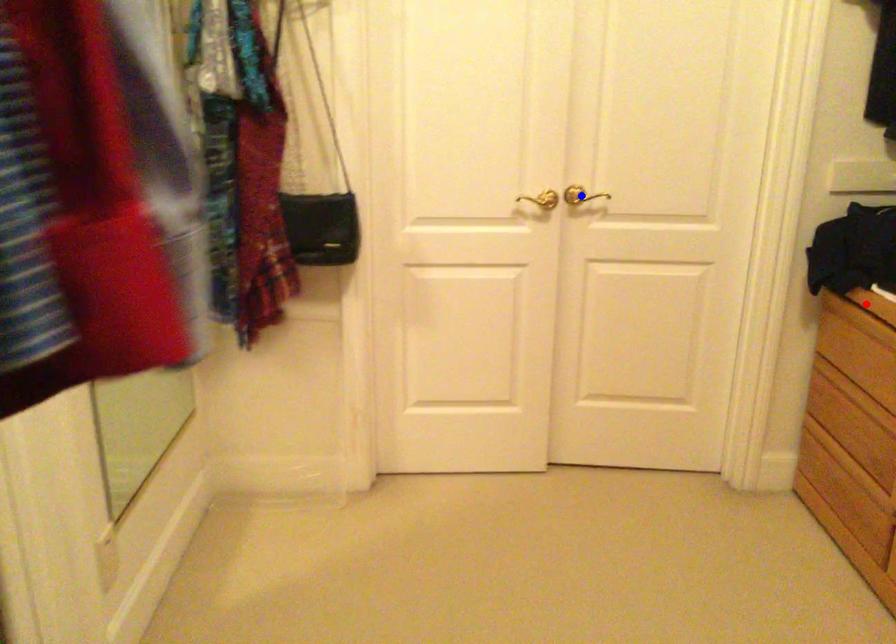
Question: Which of the two points in the image is closer to the camera?

Choices:
 (A) Blue point is closer.
 (B) Red point is closer.

Answer: (B)